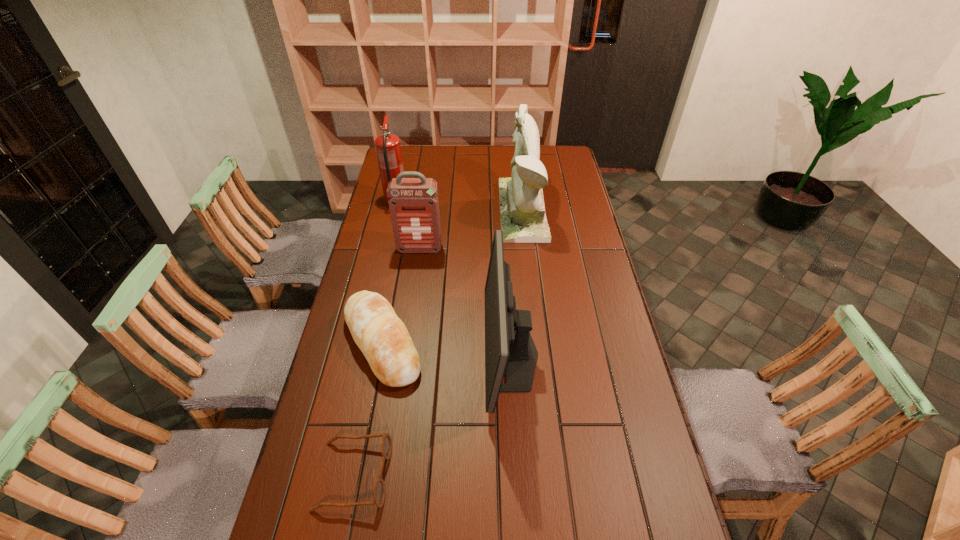
At what (x,y) coordinates should I click in order to perform the action: click on the first-aid kit at the left edge. Please return your answer as a coordinate pair (x, y). Image resolution: width=960 pixels, height=540 pixels. Looking at the image, I should click on (413, 202).

The image size is (960, 540). I want to click on bread situated at the left edge, so click(x=382, y=337).

Locate an element on the screen. spectacles at the left edge is located at coordinates (386, 445).

What are the coordinates of `vacant area at the far edge of the desktop` in the screenshot? It's located at (502, 168).

In the image, there is a desktop. Identify the location of vacant space at the left edge. (365, 360).

Where is `free space at the right edge`? free space at the right edge is located at coordinates pyautogui.click(x=588, y=256).

This screenshot has height=540, width=960. In order to click on vacant space at the far right corner in this screenshot , I will do `click(567, 152)`.

Find the location of a particular element. This screenshot has width=960, height=540. vacant point located between the fifth tallest object and the first-aid kit is located at coordinates (401, 296).

You are a GUI agent. You are given a task and a screenshot of the screen. Output one action in this format:
    pyautogui.click(x=<x>, y=<y>)
    Task: Click on the vacant area that lies between the second shortest object and the sculpture
    The image size is (960, 540).
    Given the screenshot: What is the action you would take?
    pyautogui.click(x=452, y=276)

Identify the location of vacant area between the spectacles and the sculpture. [439, 342].